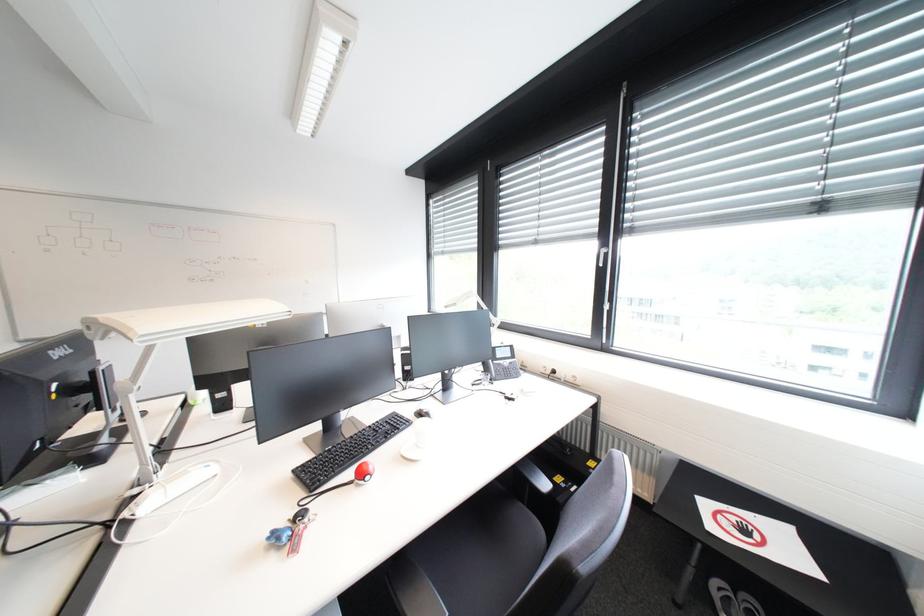
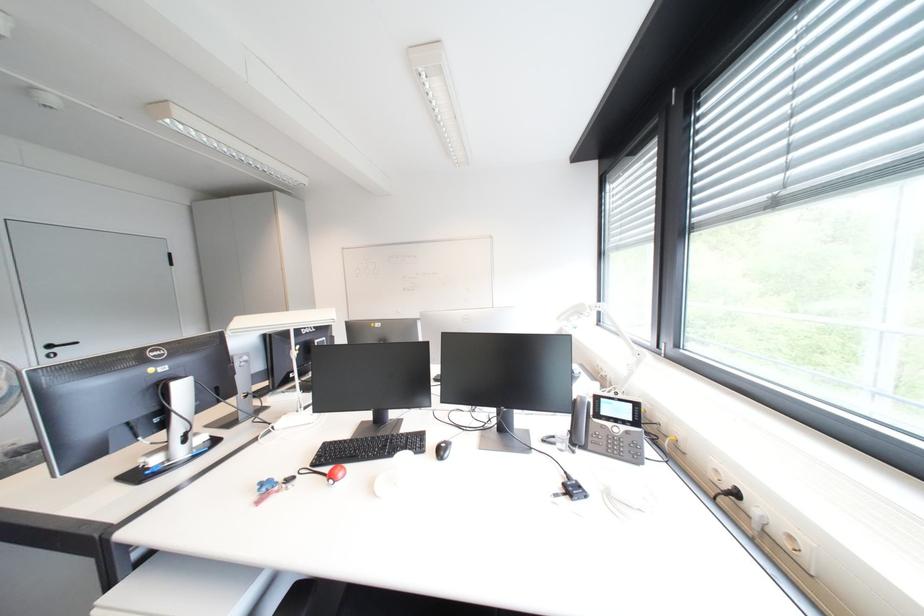
Question: Based on the continuous images, in which direction is the camera rotating? Reply with the corresponding letter.

Choices:
 (A) Left
 (B) Right
 (C) Up
 (D) Down

Answer: (A)